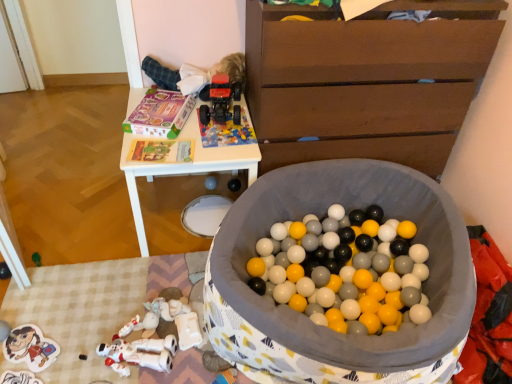
Find the location of a particular element. This screenshot has height=384, width=512. vacant area that lies between matte plastic sticker at lower left, which ranks as the 6th toy in right-to-left order, and white matte plastic robot at lower left, which is the 2th toy from left to right is located at coordinates (75, 348).